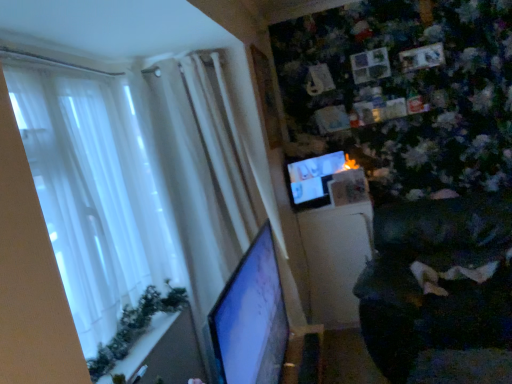
Question: From the image's perspective, would you say white sheer curtain at left is positioned over matte black monitor at center, arranged as the 2th computer monitor when ordered from the bottom?

Choices:
 (A) no
 (B) yes

Answer: (A)

Question: Does white sheer curtain at left have a greater width compared to matte black monitor at center, the first computer monitor in the right-to-left sequence?

Choices:
 (A) no
 (B) yes

Answer: (B)

Question: From a real-world perspective, is white sheer curtain at left under matte black monitor at center, positioned as the 1th computer monitor in top-to-bottom order?

Choices:
 (A) no
 (B) yes

Answer: (A)

Question: Can you confirm if white sheer curtain at left is thinner than matte black monitor at center, arranged as the 2th computer monitor when ordered from the bottom?

Choices:
 (A) no
 (B) yes

Answer: (A)

Question: Is white sheer curtain at left shorter than matte black monitor at center, marked as the second computer monitor in a left-to-right arrangement?

Choices:
 (A) no
 (B) yes

Answer: (A)

Question: Does white sheer curtain at left appear on the right side of matte black monitor at center, the first computer monitor in the right-to-left sequence?

Choices:
 (A) yes
 (B) no

Answer: (B)

Question: Is white sheer curtain at left shorter than matte black monitor at left, the first computer monitor from the left?

Choices:
 (A) yes
 (B) no

Answer: (B)

Question: Is matte black monitor at left, the second computer monitor in the top-to-bottom sequence, at the back of white sheer curtain at left?

Choices:
 (A) yes
 (B) no

Answer: (B)

Question: From a real-world perspective, is white sheer curtain at left located higher than matte black monitor at left, the first computer monitor from the left?

Choices:
 (A) yes
 (B) no

Answer: (A)

Question: Can you confirm if white sheer curtain at left is taller than matte black monitor at left, the first computer monitor from the left?

Choices:
 (A) no
 (B) yes

Answer: (B)

Question: Is white sheer curtain at left next to matte black monitor at left, the second computer monitor in the top-to-bottom sequence, and touching it?

Choices:
 (A) no
 (B) yes

Answer: (A)

Question: Considering the relative sizes of white sheer curtain at left and matte black monitor at left, the first computer monitor from the front, in the image provided, is white sheer curtain at left bigger than matte black monitor at left, the first computer monitor from the front,?

Choices:
 (A) yes
 (B) no

Answer: (A)

Question: Would you say matte black monitor at center, marked as the second computer monitor in a left-to-right arrangement, is part of dark fabric swivel chair at lower right's contents?

Choices:
 (A) no
 (B) yes

Answer: (A)